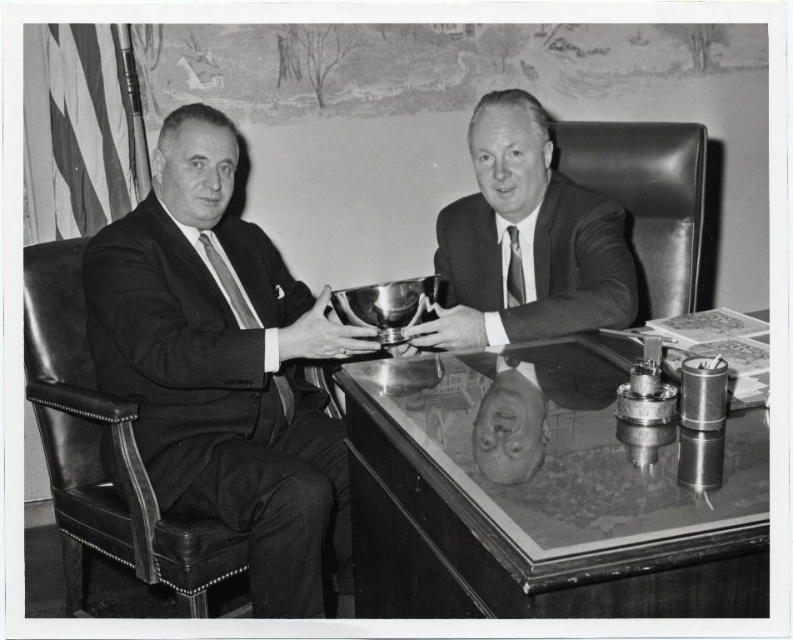
Who is more distant from viewer, (511, 353) or (508, 193)?

The point (508, 193) is behind.

Looking at this image, does shiny glass table at center have a lesser width compared to shiny silver bowl at center?

In fact, shiny glass table at center might be wider than shiny silver bowl at center.

I want to click on shiny glass table at center, so click(x=546, y=493).

Which of these two, shiny glass table at center or matte black suit at left, stands taller?

matte black suit at left

Is shiny glass table at center above matte black suit at left?

No.

Is point (611, 452) farther from viewer compared to point (228, 189)?

No, it is in front of (228, 189).

In order to click on shiny glass table at center in this screenshot , I will do `click(546, 493)`.

At what (x,y) coordinates should I click in order to perform the action: click on matte black suit at left. Please return your answer as a coordinate pair (x, y). This screenshot has width=793, height=640. Looking at the image, I should click on (225, 368).

Is point (132, 323) positioned after point (447, 321)?

Yes, point (132, 323) is behind point (447, 321).

At what (x,y) coordinates should I click in order to perform the action: click on matte black suit at left. Please return your answer as a coordinate pair (x, y). The image size is (793, 640). Looking at the image, I should click on (225, 368).